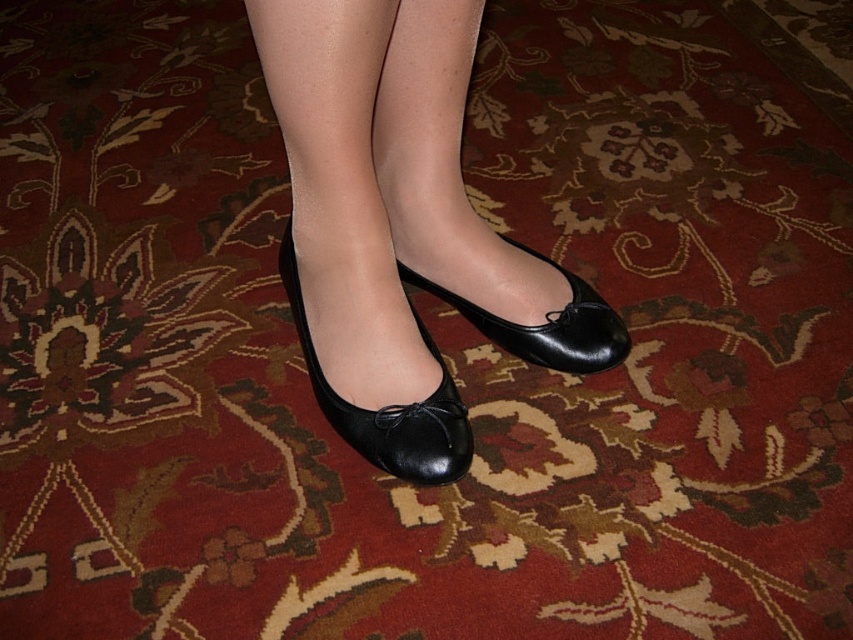
Question: Which is nearer to the black leather shoe at center?

Choices:
 (A) shiny black shoe at center
 (B) black leather shoes at center

Answer: (B)

Question: Which object is positioned closest to the black leather shoe at center?

Choices:
 (A) black leather shoes at center
 (B) shiny black shoe at center

Answer: (A)

Question: Does black leather shoe at center lie behind shiny black shoe at center?

Choices:
 (A) yes
 (B) no

Answer: (B)

Question: Does black leather shoes at center have a larger size compared to black leather shoe at center?

Choices:
 (A) no
 (B) yes

Answer: (B)

Question: Among these objects, which one is farthest from the camera?

Choices:
 (A) shiny black shoe at center
 (B) black leather shoes at center

Answer: (A)

Question: In this image, where is black leather shoe at center located relative to shiny black shoe at center?

Choices:
 (A) above
 (B) below

Answer: (B)